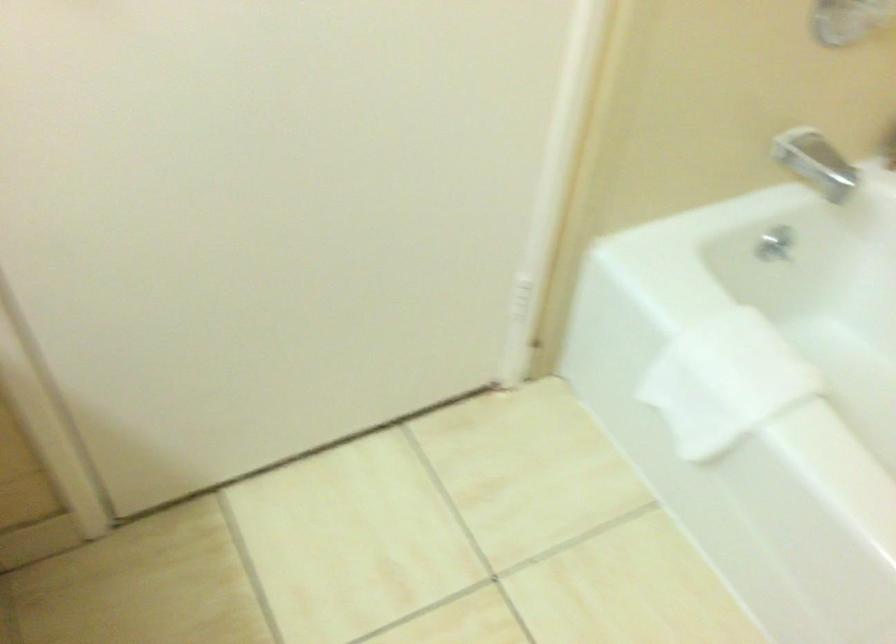
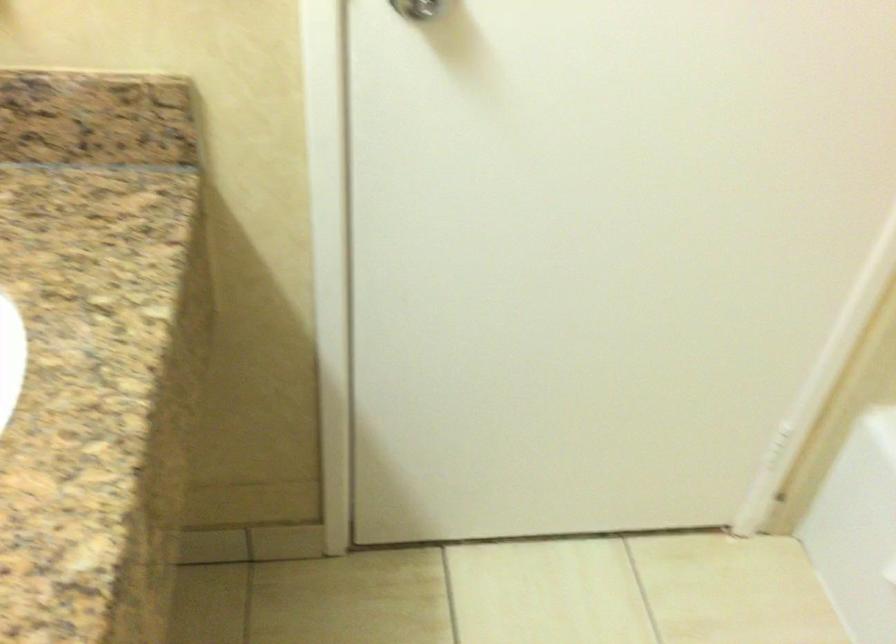
Question: Based on the continuous images, in which direction is the camera rotating? Reply with the corresponding letter.

Choices:
 (A) Left
 (B) Right
 (C) Up
 (D) Down

Answer: (A)